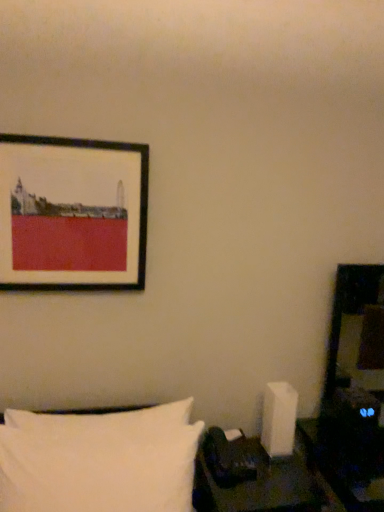
Identify the location of blank space situated above black leather table at lower right (from a real-world perspective). Image resolution: width=384 pixels, height=512 pixels. [x=256, y=492].